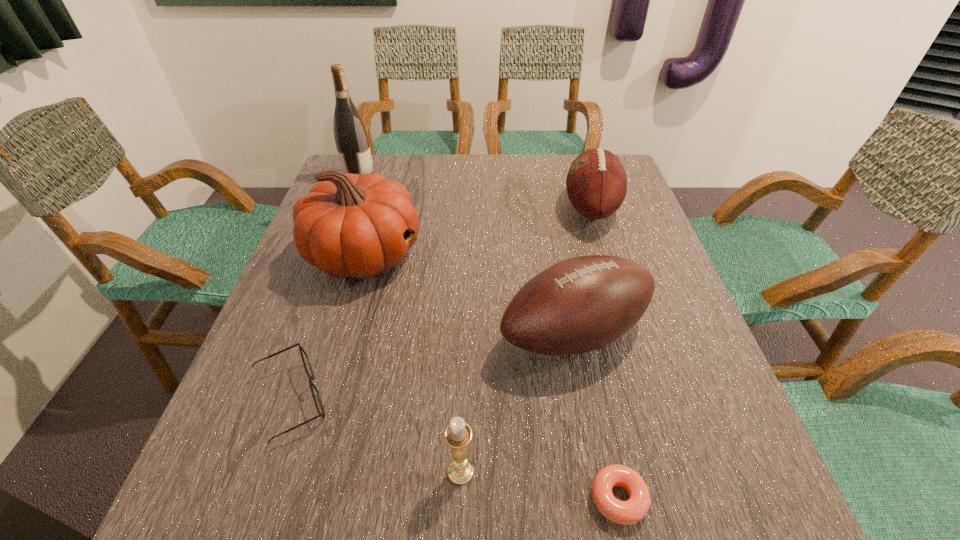
The width and height of the screenshot is (960, 540). I want to click on free space between the spectacles and the candle holder, so click(375, 436).

Locate an element on the screen. The height and width of the screenshot is (540, 960). vacant area between the doughnut and the second tallest object is located at coordinates (492, 376).

This screenshot has width=960, height=540. Find the location of `blank region between the farther football (American) and the sixth tallest object`. blank region between the farther football (American) and the sixth tallest object is located at coordinates (441, 304).

Locate an element on the screen. vacant region between the spectacles and the fourth object from right to left is located at coordinates (375, 436).

This screenshot has width=960, height=540. Find the location of `unoccupied area between the tallest object and the sixth tallest object`. unoccupied area between the tallest object and the sixth tallest object is located at coordinates (324, 288).

The height and width of the screenshot is (540, 960). I want to click on free space between the sixth shortest object and the spectacles, so click(x=327, y=327).

Locate an element on the screen. free space between the nearer football (American) and the pumpkin is located at coordinates [x=469, y=294].

Identify which object is the fifth nearest to the candle holder. Please provide its 2D coordinates. Your answer should be formatted as a tuple, i.e. [(x, y)], where the tuple contains the x and y coordinates of a point satisfying the conditions above.

[(596, 183)]

At what (x,y) coordinates should I click in order to perform the action: click on object that ranks as the sixth closest to the shortest object. Please return your answer as a coordinate pair (x, y). Looking at the image, I should click on (351, 138).

This screenshot has width=960, height=540. I want to click on free region that satisfies the following two spatial constraints: 1. on the label of the wine bottle; 2. on the right side of the nearer football (American), so click(301, 334).